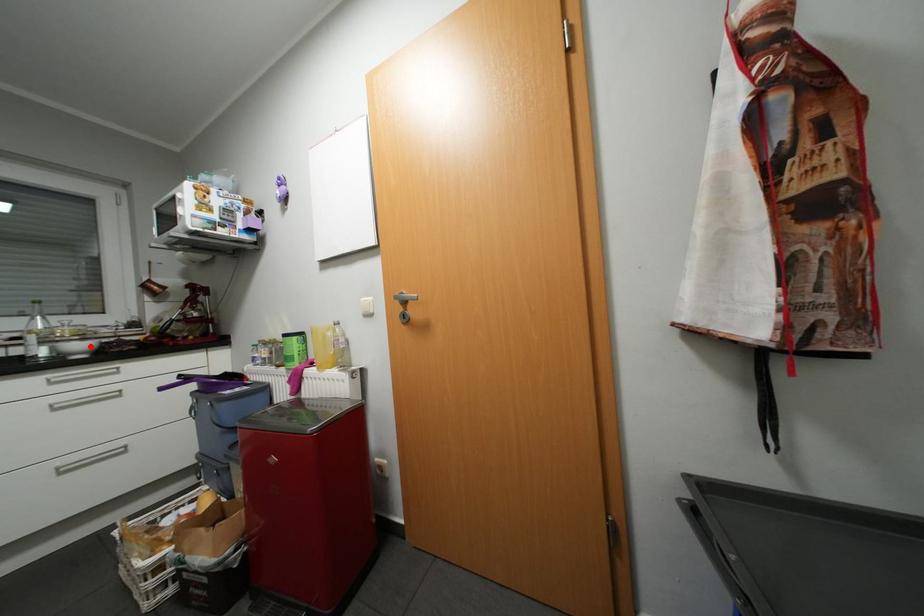
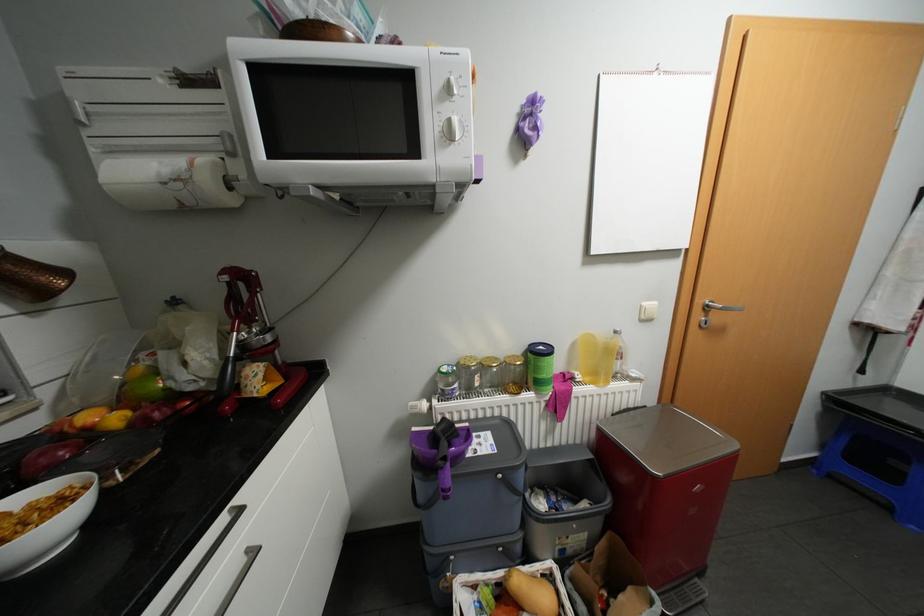
In the second image, find the point that corresponds to the highlighted location in the first image.

(44, 522)